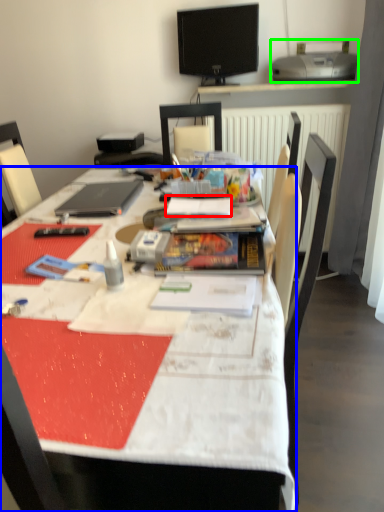
Question: Which object is positioned farthest from paperback book (highlighted by a red box)? Select from desk (highlighted by a blue box) and printer (highlighted by a green box).

Choices:
 (A) desk
 (B) printer

Answer: (B)